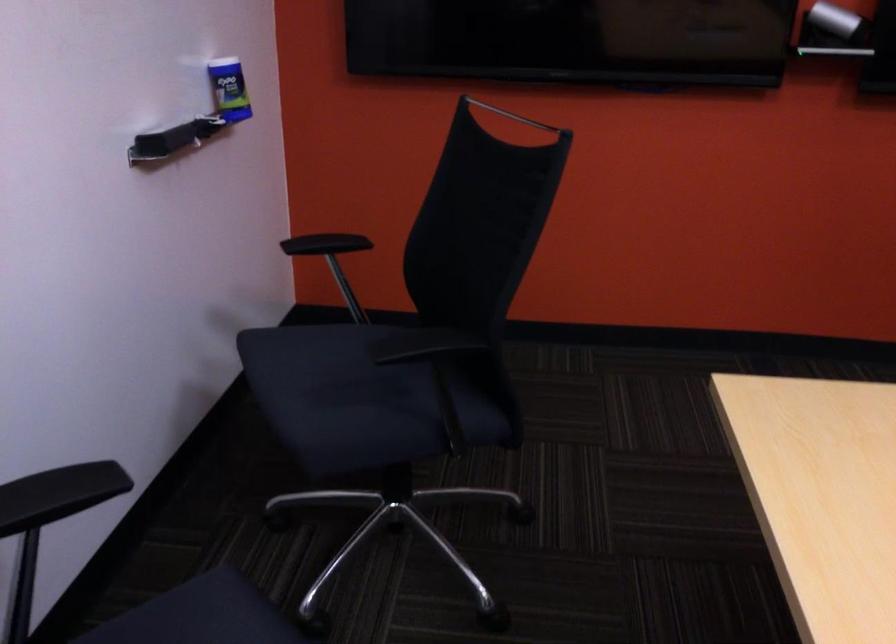
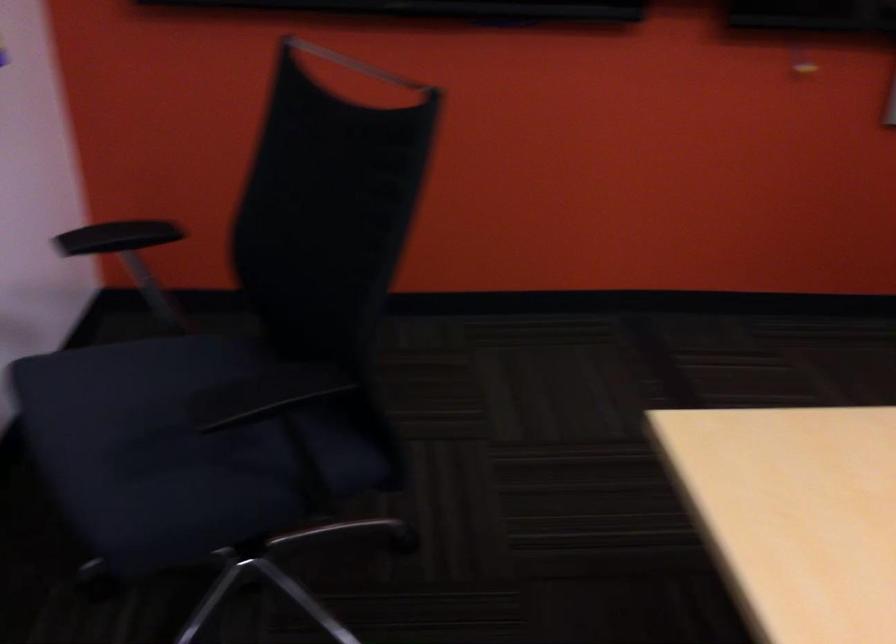
Question: What movement of the cameraman would produce the second image?

Choices:
 (A) Left
 (B) Right
 (C) Forward
 (D) Backward

Answer: (C)